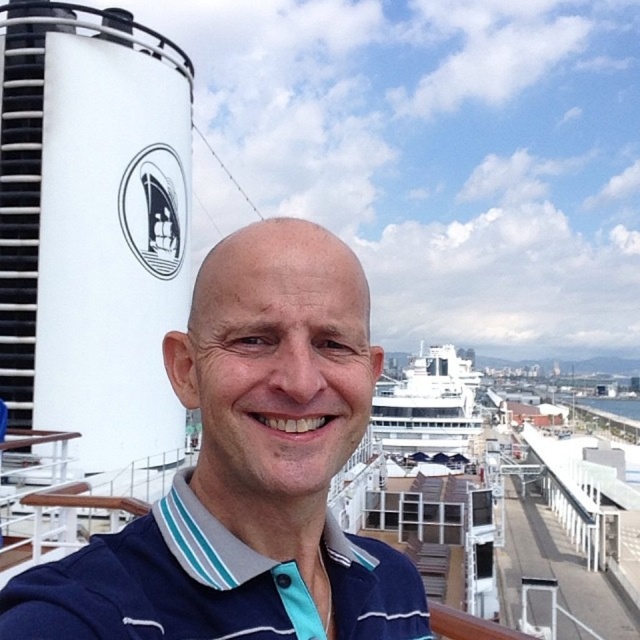
Question: Does navy blue polo shirt at center have a smaller size compared to navy blue cotton polo shirt at center?

Choices:
 (A) yes
 (B) no

Answer: (B)

Question: Among these objects, which one is farthest from the camera?

Choices:
 (A) white glossy cruise ship at upper center
 (B) navy blue cotton polo shirt at center
 (C) navy blue polo shirt at center

Answer: (A)

Question: Which object is closer to the camera taking this photo?

Choices:
 (A) navy blue polo shirt at center
 (B) navy blue cotton polo shirt at center
 (C) white glossy cruise ship at upper center

Answer: (B)

Question: Is navy blue polo shirt at center wider than navy blue cotton polo shirt at center?

Choices:
 (A) no
 (B) yes

Answer: (B)

Question: Is navy blue cotton polo shirt at center to the right of white glossy cruise ship at upper center from the viewer's perspective?

Choices:
 (A) no
 (B) yes

Answer: (A)

Question: Among these points, which one is farthest from the camera?

Choices:
 (A) [364, 596]
 (B) [429, 403]

Answer: (B)